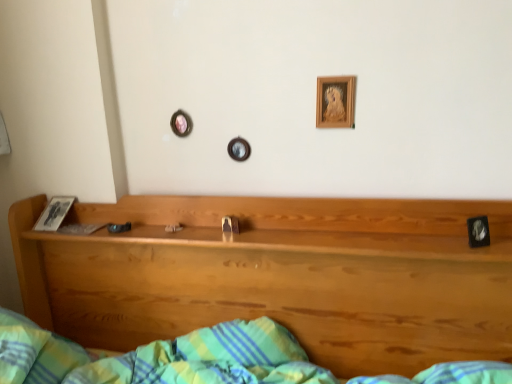
Locate an element on the screen. vacant position to the left of black glossy picture frame at right, the first picture frame from the right is located at coordinates (417, 243).